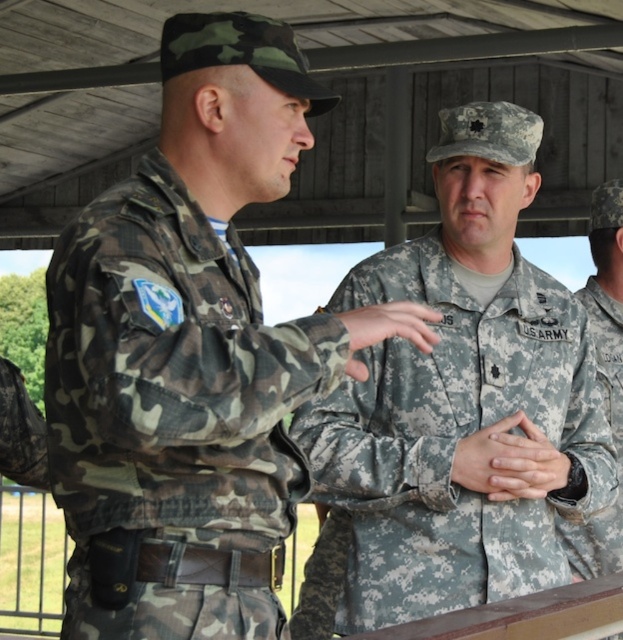
Which is behind, point (604, 360) or point (464, 458)?

Positioned behind is point (604, 360).

Can you confirm if camouflage fabric uniform at right is positioned above camouflage fabric hands at center?

Yes, camouflage fabric uniform at right is above camouflage fabric hands at center.

What do you see at coordinates (609, 422) in the screenshot?
I see `camouflage fabric uniform at right` at bounding box center [609, 422].

Identify the location of camouflage fabric uniform at right. The height and width of the screenshot is (640, 623). (609, 422).

Is camo fabric uniform at center positioned before camouflage fabric hands at center?

Yes.

Between point (82, 212) and point (455, 465), which one is positioned behind?

The point (455, 465) is more distant.

Where is `camo fabric uniform at center`? This screenshot has width=623, height=640. camo fabric uniform at center is located at coordinates (174, 412).

Which is behind, point (506, 550) or point (472, 454)?

Point (506, 550)

Between point (391, 465) and point (503, 454), which one is positioned in front?

Positioned in front is point (503, 454).

This screenshot has height=640, width=623. What are the coordinates of `camouflage fabric uniform at center` in the screenshot? It's located at (445, 448).